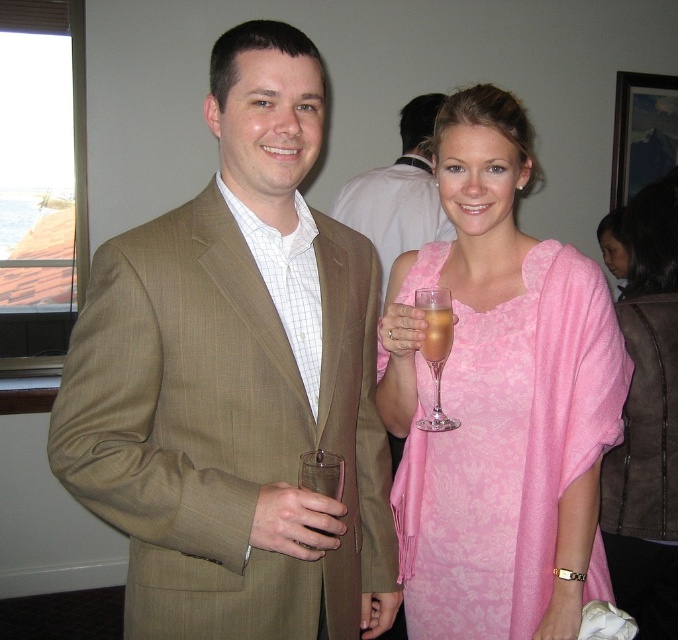
Is the position of matte brown suit at center more distant than that of clear glass at center?

Yes, matte brown suit at center is further from the viewer.

Is matte brown suit at center wider than clear glass at center?

Correct, the width of matte brown suit at center exceeds that of clear glass at center.

Who is more forward, [365,182] or [325,470]?

Point [325,470]

What are the coordinates of `matte brown suit at center` in the screenshot? It's located at (398, 193).

Is matte brown suit at center shorter than translucent glass at center?

No, matte brown suit at center is not shorter than translucent glass at center.

Does matte brown suit at center have a lesser width compared to translucent glass at center?

No.

The width and height of the screenshot is (678, 640). I want to click on matte brown suit at center, so click(x=398, y=193).

What do you see at coordinates (237, 381) in the screenshot?
I see `tan pinstripe suit at center` at bounding box center [237, 381].

Locate an element on the screen. This screenshot has width=678, height=640. tan pinstripe suit at center is located at coordinates (237, 381).